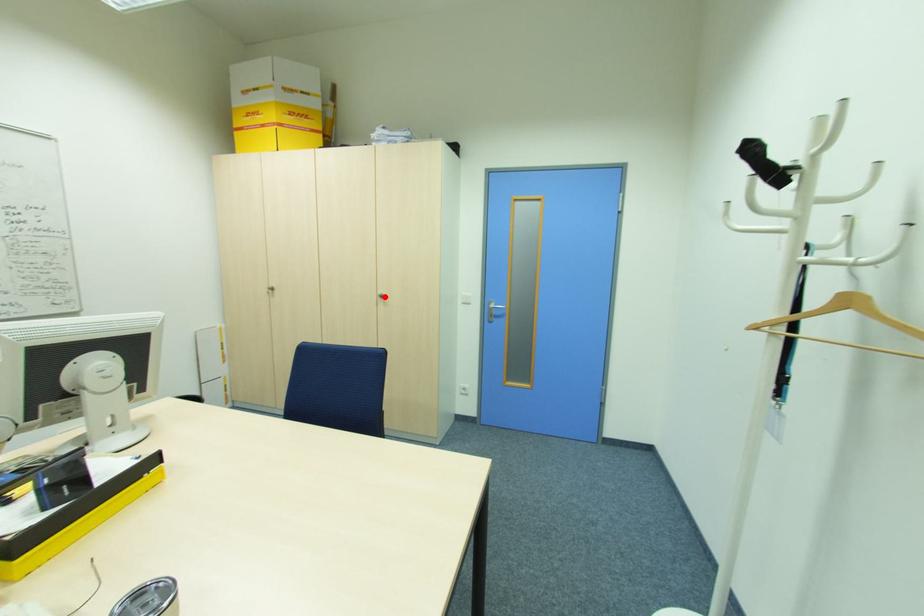
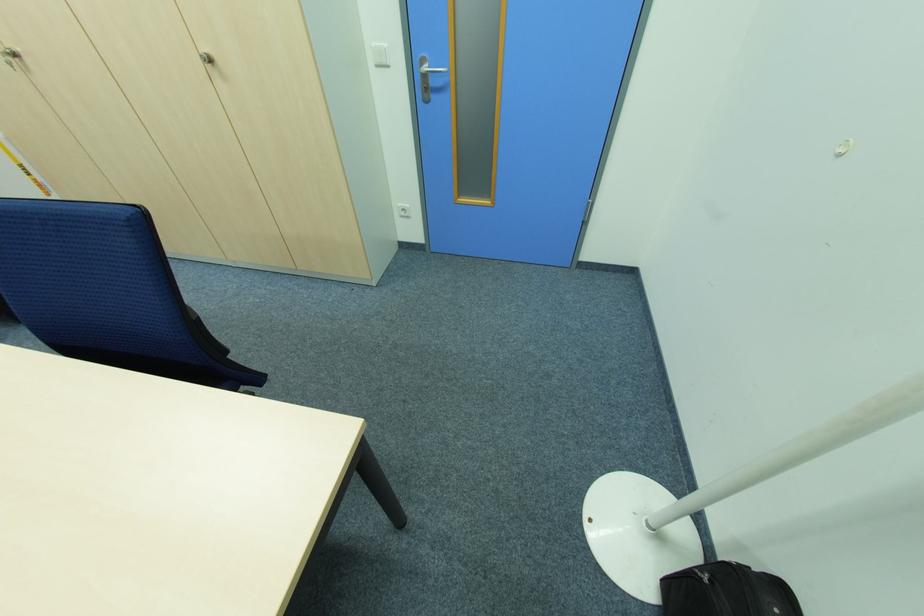
Find the pixel in the second image that matches the highlighted location in the first image.

(213, 62)